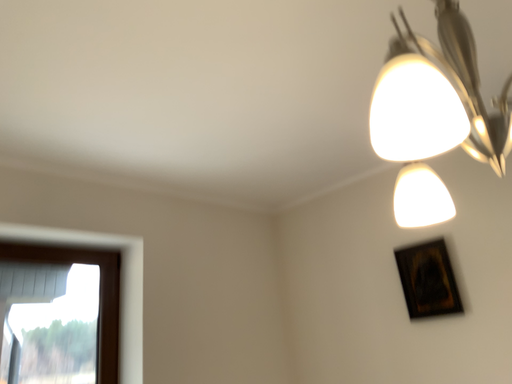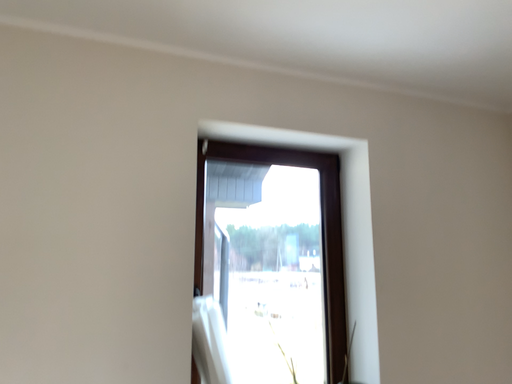
Question: How did the camera likely rotate when shooting the video?

Choices:
 (A) rotated upward
 (B) rotated downward

Answer: (B)